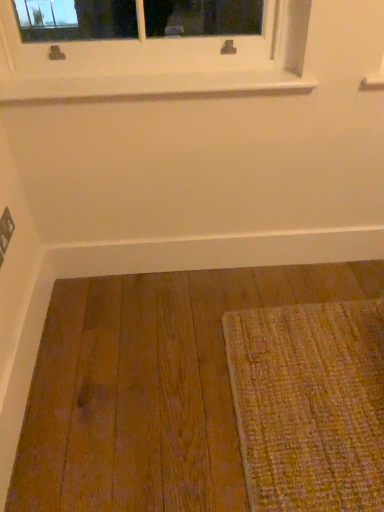
Question: Can you confirm if white smooth baseboard at lower center is shorter than white smooth window sill at upper center?

Choices:
 (A) no
 (B) yes

Answer: (A)

Question: From the image's perspective, would you say white smooth baseboard at lower center is shown under white smooth window sill at upper center?

Choices:
 (A) yes
 (B) no

Answer: (A)

Question: Is white smooth baseboard at lower center facing away from white smooth window sill at upper center?

Choices:
 (A) yes
 (B) no

Answer: (B)

Question: Can white smooth window sill at upper center be found inside white smooth baseboard at lower center?

Choices:
 (A) yes
 (B) no

Answer: (B)

Question: Considering the relative sizes of white smooth baseboard at lower center and white smooth window sill at upper center in the image provided, is white smooth baseboard at lower center thinner than white smooth window sill at upper center?

Choices:
 (A) no
 (B) yes

Answer: (B)

Question: Is white smooth baseboard at lower center taller than white smooth window sill at upper center?

Choices:
 (A) yes
 (B) no

Answer: (A)

Question: Are white smooth window sill at upper center and white smooth baseboard at lower center located far from each other?

Choices:
 (A) no
 (B) yes

Answer: (A)

Question: Is white smooth window sill at upper center at the right side of white smooth baseboard at lower center?

Choices:
 (A) no
 (B) yes

Answer: (A)

Question: Does white smooth window sill at upper center have a greater width compared to white smooth baseboard at lower center?

Choices:
 (A) yes
 (B) no

Answer: (A)

Question: Is white smooth window sill at upper center not inside white smooth baseboard at lower center?

Choices:
 (A) no
 (B) yes

Answer: (B)

Question: From a real-world perspective, is white smooth window sill at upper center located higher than white smooth baseboard at lower center?

Choices:
 (A) yes
 (B) no

Answer: (A)

Question: Considering the relative positions of white smooth window sill at upper center and white smooth baseboard at lower center in the image provided, is white smooth window sill at upper center in front of white smooth baseboard at lower center?

Choices:
 (A) yes
 (B) no

Answer: (A)

Question: From the image's perspective, is white smooth baseboard at lower center positioned above or below white smooth window sill at upper center?

Choices:
 (A) below
 (B) above

Answer: (A)